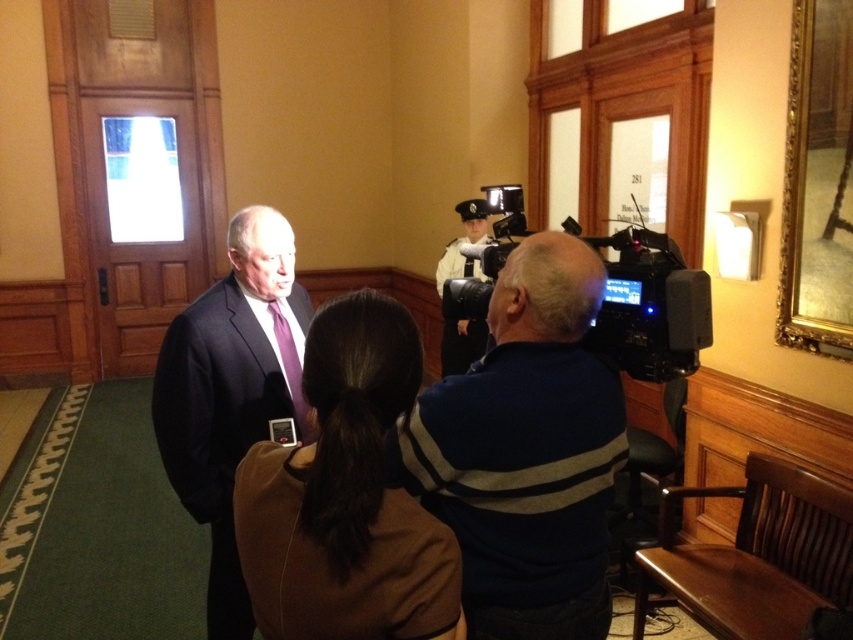
You are a photographer setting up for a group photo. You need to position a microphone stand between the striped sweater at center and the white uniform at center. Based on their positions, where should you place the microphone stand?

The microphone stand should be placed between the striped sweater at center and the white uniform at center, as the striped sweater at center is below the white uniform at center, so placing it in the middle vertically would ensure it is between them.

You are a photographer setting up a shoot in the room. You need to position a spotlight so that it illuminates both the matte black suit at center and the white uniform at center. Given their positions, which object should be placed closer to the light source to ensure both are equally visible?

The matte black suit at center should be placed closer to the light source because it is below the white uniform at center, and since black absorbs more light, positioning it nearer ensures both receive adequate illumination.

You are a photographer setting up for a group photo. You need to position the striped sweater at center and the matte black suit at center so that both are visible. Based on their current positions, which one is closer to the camera?

The striped sweater at center is closer to the camera because it is in front of the matte black suit at center.